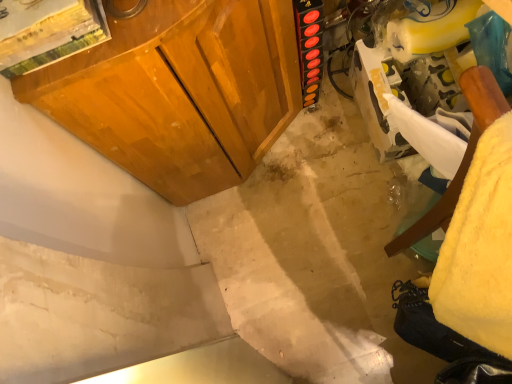
The image size is (512, 384). In order to click on free location in front of wooden cabinet at left in this screenshot , I will do pos(290,241).